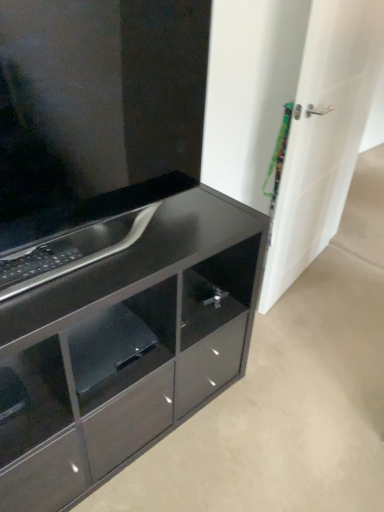
Locate an element on the screen. The height and width of the screenshot is (512, 384). vacant location below glossy black cabinet at center (from a real-world perspective) is located at coordinates (136, 227).